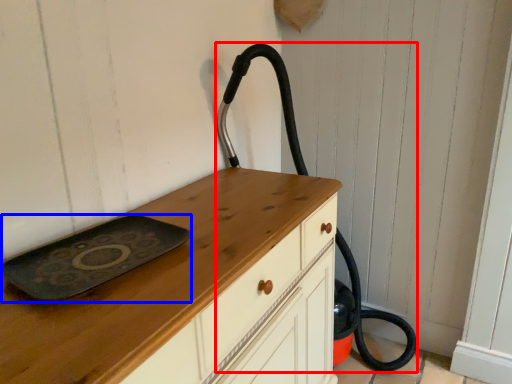
Question: Which object appears closest to the camera in this image, fire hose (highlighted by a red box) or tray (highlighted by a blue box)?

Choices:
 (A) fire hose
 (B) tray

Answer: (B)